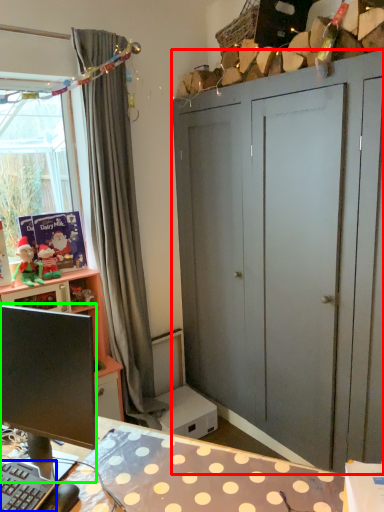
Question: Based on their relative distances, which object is nearer to dresser (highlighted by a red box)? Choose from computer keyboard (highlighted by a blue box) and computer monitor (highlighted by a green box).

Choices:
 (A) computer keyboard
 (B) computer monitor

Answer: (B)